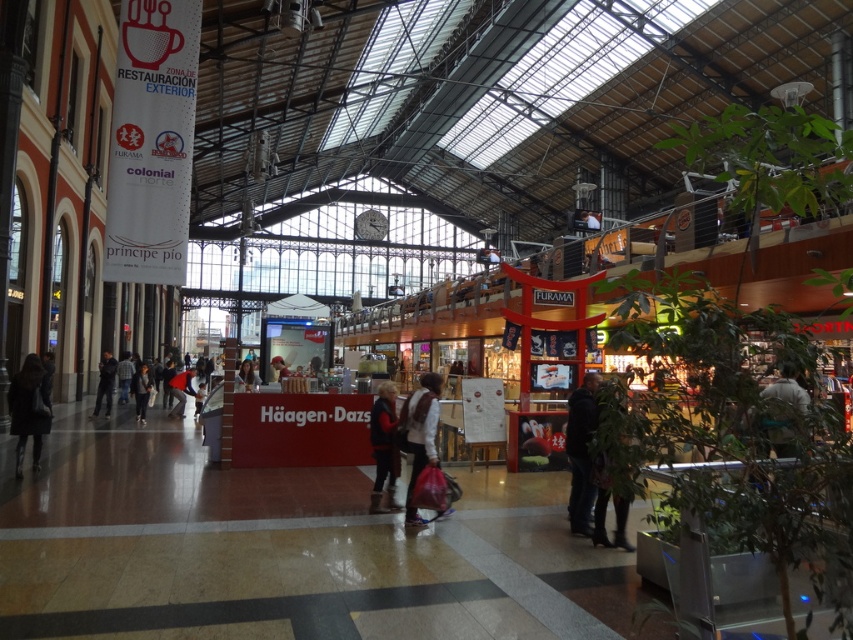
Is white cotton jacket at center positioned behind orange fabric jacket at center?

That is False.

Is white cotton jacket at center to the right of orange fabric jacket at center from the viewer's perspective?

Correct, you'll find white cotton jacket at center to the right of orange fabric jacket at center.

Is point (431, 384) positioned before point (177, 404)?

Yes, it is.

Where is `white cotton jacket at center`? white cotton jacket at center is located at coordinates (419, 435).

Is point (579, 484) behind point (604, 513)?

That is True.

Can you confirm if dark blue jeans at center is bigger than dark brown leather boots at lower right?

Indeed, dark blue jeans at center has a larger size compared to dark brown leather boots at lower right.

Locate an element on the screen. The image size is (853, 640). dark blue jeans at center is located at coordinates (581, 452).

Who is positioned more to the right, dark blue jeans at center or dark brown leather coat at lower left?

From the viewer's perspective, dark blue jeans at center appears more on the right side.

Locate an element on the screen. This screenshot has height=640, width=853. dark blue jeans at center is located at coordinates (581, 452).

Is point (573, 520) farther from viewer compared to point (25, 428)?

No, it is in front of (25, 428).

Locate an element on the screen. The image size is (853, 640). dark blue jeans at center is located at coordinates (581, 452).